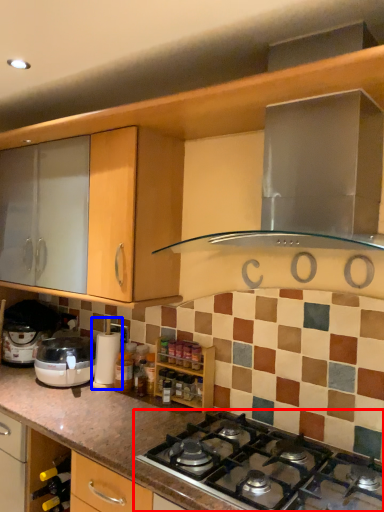
Question: Which point is further to the camera, gas stove (highlighted by a red box) or coffee machine (highlighted by a blue box)?

Choices:
 (A) gas stove
 (B) coffee machine

Answer: (B)